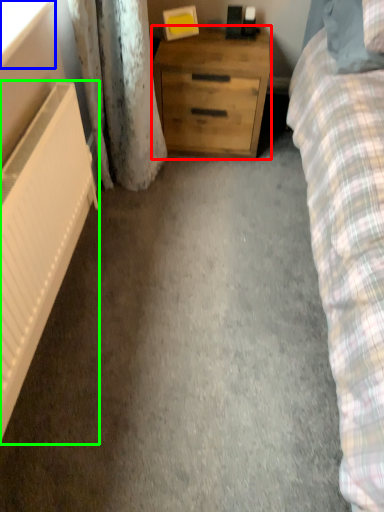
Question: Based on their relative distances, which object is nearer to chest of drawers (highlighted by a red box)? Choose from window screen (highlighted by a blue box) and radiator (highlighted by a green box).

Choices:
 (A) window screen
 (B) radiator

Answer: (B)